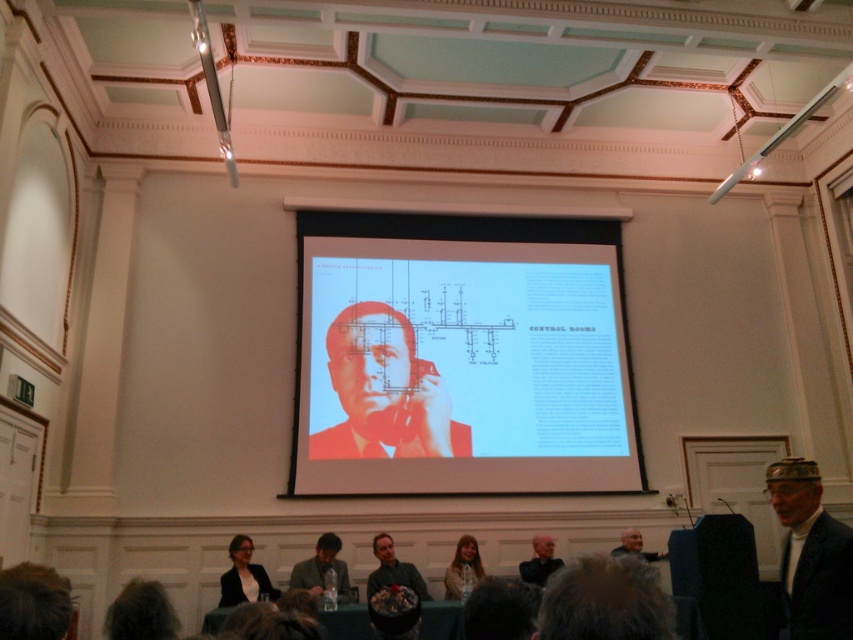
You are an attendee at the presentation and want to discreetly pass a note to the person sitting next to you. The note is on the table in front of you. Which jacket, the black fabric jacket at lower center or the gray fabric jacket at lower right, is closer to the note?

The black fabric jacket at lower center is closer to the note because it is positioned to the left of the gray fabric jacket at lower right, and since the note is on the table in front of you, the black fabric jacket at lower center would be nearer.